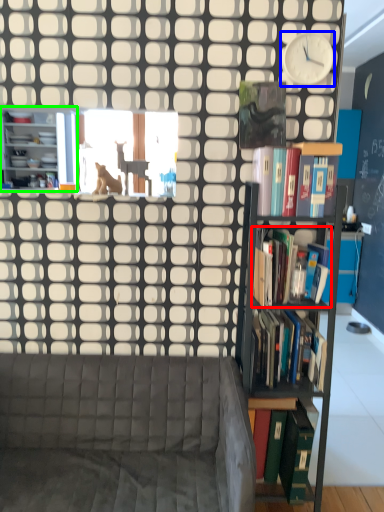
Question: Which is nearer to the book (highlighted by a red box)? clock (highlighted by a blue box) or bookcase (highlighted by a green box).

Choices:
 (A) clock
 (B) bookcase

Answer: (A)